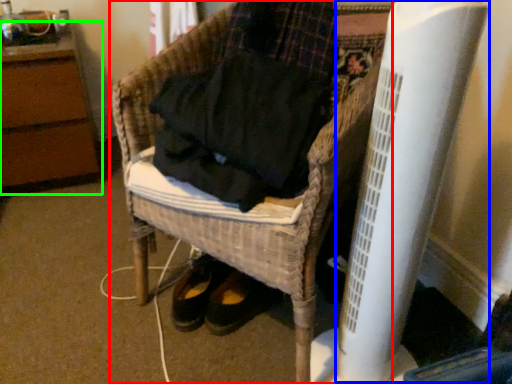
Question: Estimate the real-world distances between objects in this image. Which object is closer to furniture (highlighted by a red box), radiator (highlighted by a blue box) or furniture (highlighted by a green box)?

Choices:
 (A) radiator
 (B) furniture

Answer: (A)